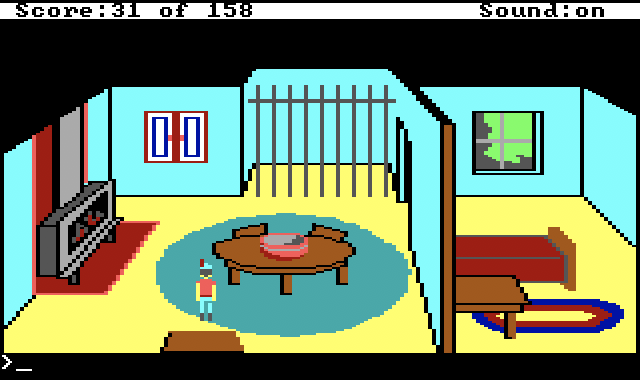
Where is `round table`? This screenshot has width=640, height=380. round table is located at coordinates (259, 252).